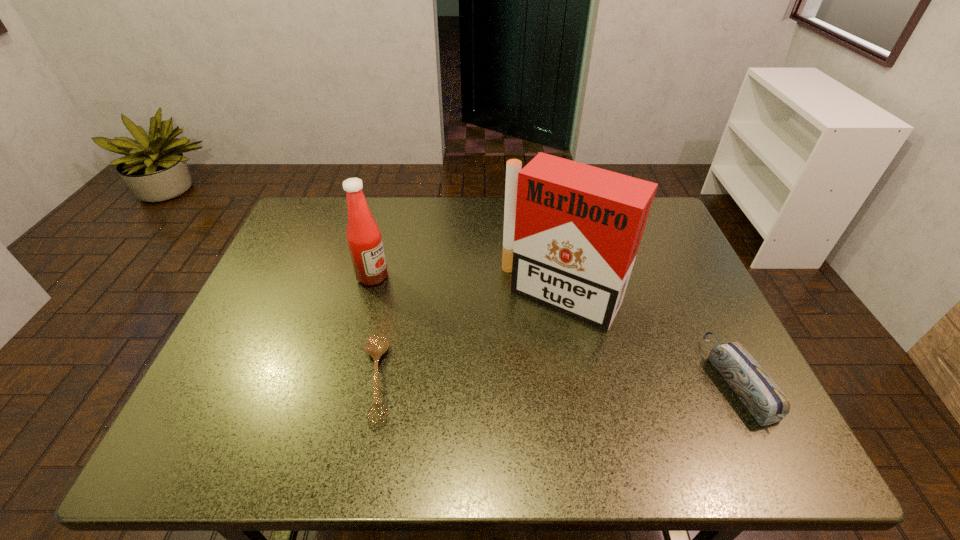
Identify the location of ladle. This screenshot has width=960, height=540. [377, 344].

The image size is (960, 540). What are the coordinates of `pencil box` in the screenshot? It's located at click(x=766, y=402).

Locate an element on the screen. The height and width of the screenshot is (540, 960). the rightmost object is located at coordinates (766, 402).

The height and width of the screenshot is (540, 960). What are the coordinates of `cigarette case` in the screenshot? It's located at (572, 231).

Locate an element on the screen. the tallest object is located at coordinates (572, 231).

The width and height of the screenshot is (960, 540). What are the coordinates of `condiment` in the screenshot? It's located at (364, 238).

The image size is (960, 540). I want to click on free region located 0.300m on the right of the shortest object, so click(532, 379).

Image resolution: width=960 pixels, height=540 pixels. What are the coordinates of `blank area located 0.400m on the left of the rightmost object` in the screenshot? It's located at [533, 381].

The image size is (960, 540). I want to click on vacant area located on the front-facing side of the cigarette case, so click(523, 342).

In order to click on vacant space located on the front-facing side of the cigarette case in this screenshot , I will do `click(487, 397)`.